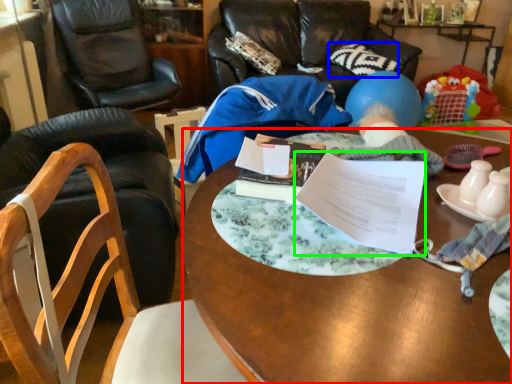
Question: Which object is the closest to the desk (highlighted by a red box)? Choose among these: pillow (highlighted by a blue box) or document (highlighted by a green box).

Choices:
 (A) pillow
 (B) document

Answer: (B)